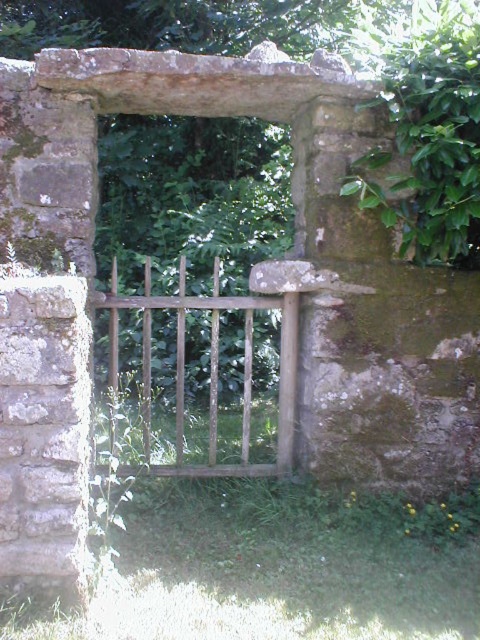
Can you confirm if green grass at center is positioned below wooden gate at center?

Indeed, green grass at center is positioned under wooden gate at center.

Between point (160, 592) and point (245, 358), which one is positioned behind?

The point (245, 358) is behind.

The height and width of the screenshot is (640, 480). Identify the location of green grass at center. (279, 566).